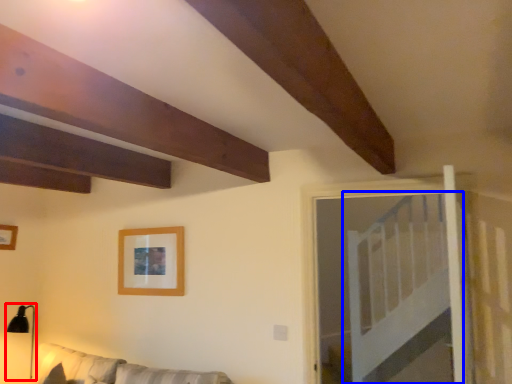
Question: Which object appears closest to the camera in this image, lamp (highlighted by a red box) or bed (highlighted by a blue box)?

Choices:
 (A) lamp
 (B) bed

Answer: (B)